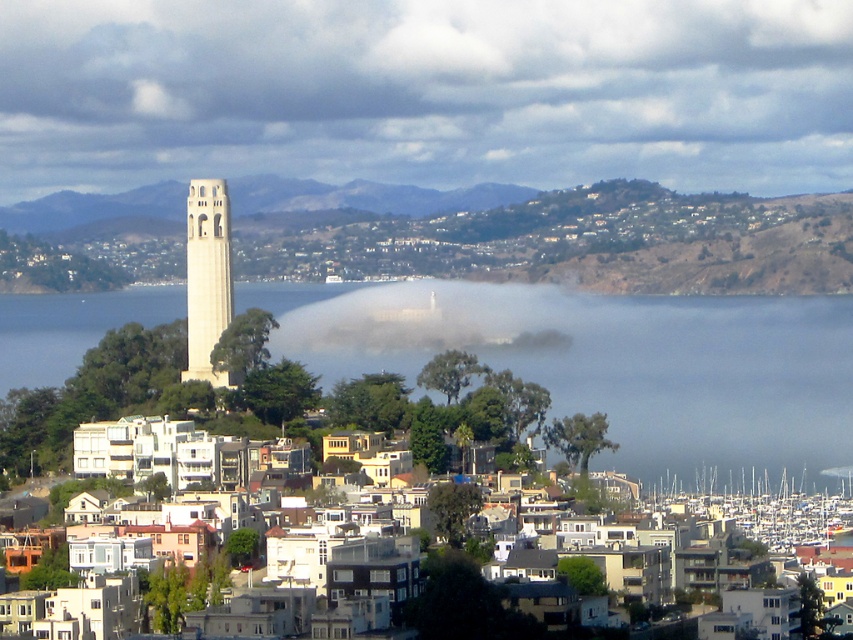
Question: Which object is closer to the camera taking this photo?

Choices:
 (A) white stone bell tower at left
 (B) white mist at center

Answer: (A)

Question: Among these points, which one is farthest from the camera?

Choices:
 (A) (194, 198)
 (B) (740, 80)
 (C) (497, 317)
 (D) (618, 467)

Answer: (B)

Question: In this image, where is white mist at center located relative to white stone bell tower at left?

Choices:
 (A) above
 (B) below

Answer: (A)

Question: Is white translucent fog at center further to the viewer compared to white stone bell tower at left?

Choices:
 (A) yes
 (B) no

Answer: (B)

Question: Is white mist at center thinner than transparent fog at center?

Choices:
 (A) no
 (B) yes

Answer: (A)

Question: Among these objects, which one is nearest to the camera?

Choices:
 (A) white mist at center
 (B) white stone bell tower at left
 (C) transparent fog at center

Answer: (C)